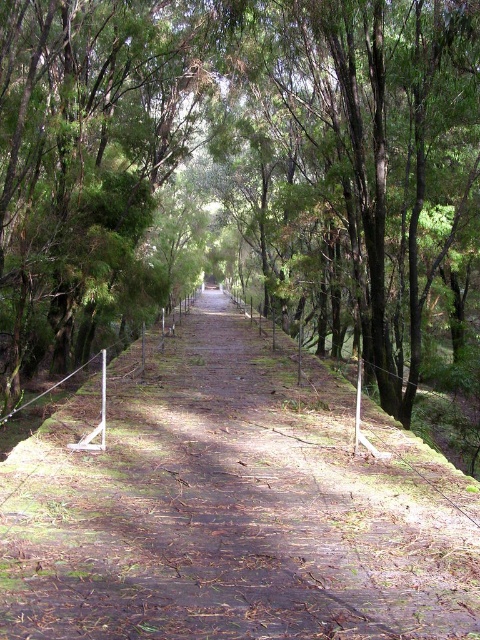
You are a hiker trying to navigate through the forest. You see the green leafy tree at center and the dirt path at center. Which one is wider?

The green leafy tree at center is bigger than the dirt path at center, so the green leafy tree at center is wider.

You are a hiker carrying a 2 meters wide tent. You need to set up camp along the dirt path at center. Considering the green leafy tree at center, will the tent fit between the tree and the path edges?

The green leafy tree at center is wider than the dirt path at center. Since the path is narrower than the tree, the tent which is 2 meters wide may not fit between the tree and the path edges. Check the actual measurements for accuracy.

You are a hiker walking along the dirt path at center in the forest. You notice the green leafy tree at center ahead of you. If you want to take a photo of the tree from the path, will the tree block your view of the sky behind it?

The green leafy tree at center is much taller than the dirt path at center, so the tree will block your view of the sky behind it when taking a photo from the path.